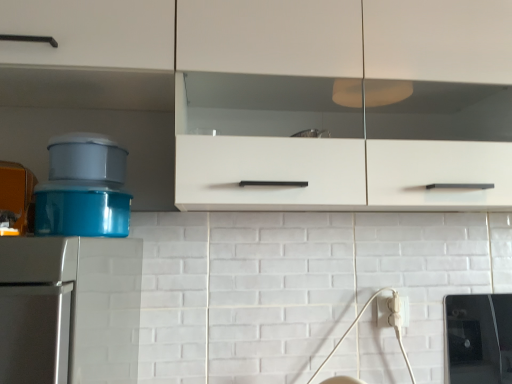
Question: Should I look upward or downward to see white matte cabinet at upper center?

Choices:
 (A) down
 (B) up

Answer: (B)

Question: Can you confirm if white matte cabinet at upper center is positioned to the right of white plastic electric outlet at lower right?

Choices:
 (A) no
 (B) yes

Answer: (A)

Question: From a real-world perspective, is white matte cabinet at upper center beneath white plastic electric outlet at lower right?

Choices:
 (A) yes
 (B) no

Answer: (B)

Question: Considering the relative sizes of white matte cabinet at upper center and white plastic electric outlet at lower right in the image provided, is white matte cabinet at upper center thinner than white plastic electric outlet at lower right?

Choices:
 (A) yes
 (B) no

Answer: (B)

Question: Considering the relative positions of white matte cabinet at upper center and white plastic electric outlet at lower right in the image provided, is white matte cabinet at upper center to the left of white plastic electric outlet at lower right from the viewer's perspective?

Choices:
 (A) yes
 (B) no

Answer: (A)

Question: From the image's perspective, is white matte cabinet at upper center beneath white plastic electric outlet at lower right?

Choices:
 (A) no
 (B) yes

Answer: (A)

Question: Is white matte cabinet at upper center closer to camera compared to white plastic electric outlet at lower right?

Choices:
 (A) yes
 (B) no

Answer: (A)

Question: Does white plastic electric outlet at lower right have a smaller size compared to white matte cabinet at upper center?

Choices:
 (A) yes
 (B) no

Answer: (A)

Question: Considering the relative positions of white plastic electric outlet at lower right and white matte cabinet at upper center in the image provided, is white plastic electric outlet at lower right in front of white matte cabinet at upper center?

Choices:
 (A) yes
 (B) no

Answer: (B)

Question: From a real-world perspective, does white plastic electric outlet at lower right sit lower than white matte cabinet at upper center?

Choices:
 (A) yes
 (B) no

Answer: (A)

Question: Does white plastic electric outlet at lower right have a greater height compared to white matte cabinet at upper center?

Choices:
 (A) yes
 (B) no

Answer: (B)

Question: From the image's perspective, is white plastic electric outlet at lower right below white matte cabinet at upper center?

Choices:
 (A) no
 (B) yes

Answer: (B)

Question: Would you say white plastic electric outlet at lower right contains white matte cabinet at upper center?

Choices:
 (A) no
 (B) yes

Answer: (A)

Question: Considering the positions of point (384, 321) and point (136, 11), is point (384, 321) closer or farther from the camera than point (136, 11)?

Choices:
 (A) closer
 (B) farther

Answer: (B)